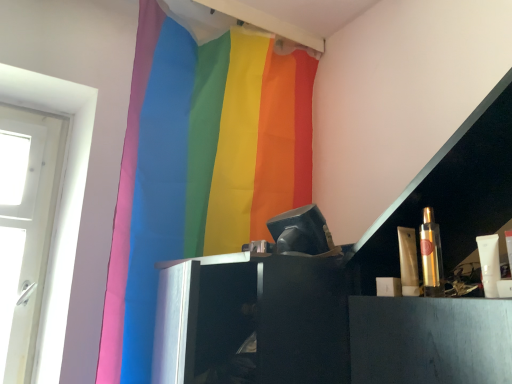
Question: Does rainbow fabric curtain at upper center contain shiny gold tube at right, which is the 2th toiletry from right to left?

Choices:
 (A) yes
 (B) no

Answer: (B)

Question: Considering the relative sizes of rainbow fabric curtain at upper center and shiny gold tube at right, which is the 2th toiletry from right to left, in the image provided, is rainbow fabric curtain at upper center taller than shiny gold tube at right, which is the 2th toiletry from right to left,?

Choices:
 (A) no
 (B) yes

Answer: (B)

Question: Is rainbow fabric curtain at upper center closer to camera compared to shiny gold tube at right, which is the first toiletry in left-to-right order?

Choices:
 (A) yes
 (B) no

Answer: (B)

Question: Considering the relative sizes of rainbow fabric curtain at upper center and shiny gold tube at right, which is the 2th toiletry from right to left, in the image provided, is rainbow fabric curtain at upper center bigger than shiny gold tube at right, which is the 2th toiletry from right to left,?

Choices:
 (A) yes
 (B) no

Answer: (A)

Question: Does rainbow fabric curtain at upper center have a lesser height compared to shiny gold tube at right, which is the first toiletry in left-to-right order?

Choices:
 (A) no
 (B) yes

Answer: (A)

Question: From a real-world perspective, is rainbow fabric curtain at upper center located beneath shiny gold tube at right, which is the 2th toiletry from right to left?

Choices:
 (A) yes
 (B) no

Answer: (B)

Question: Can you confirm if rainbow fabric curtain at upper center is taller than gold metallic spray can at right, placed as the 1th toiletry when sorted from right to left?

Choices:
 (A) yes
 (B) no

Answer: (A)

Question: Is rainbow fabric curtain at upper center positioned beyond the bounds of gold metallic spray can at right, positioned as the 2th toiletry in left-to-right order?

Choices:
 (A) no
 (B) yes

Answer: (B)

Question: Is rainbow fabric curtain at upper center positioned with its back to gold metallic spray can at right, positioned as the 2th toiletry in left-to-right order?

Choices:
 (A) yes
 (B) no

Answer: (B)

Question: From a real-world perspective, is rainbow fabric curtain at upper center below gold metallic spray can at right, positioned as the 2th toiletry in left-to-right order?

Choices:
 (A) yes
 (B) no

Answer: (B)

Question: Is rainbow fabric curtain at upper center bigger than gold metallic spray can at right, placed as the 1th toiletry when sorted from right to left?

Choices:
 (A) no
 (B) yes

Answer: (B)

Question: Is rainbow fabric curtain at upper center at the right side of gold metallic spray can at right, placed as the 1th toiletry when sorted from right to left?

Choices:
 (A) yes
 (B) no

Answer: (B)

Question: Is gold metallic spray can at right, positioned as the 2th toiletry in left-to-right order, aimed at rainbow fabric curtain at upper center?

Choices:
 (A) yes
 (B) no

Answer: (B)